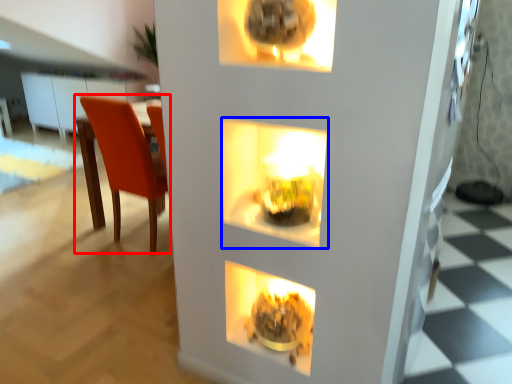
Question: Which object is closer to the camera taking this photo, chair (highlighted by a red box) or shelf (highlighted by a blue box)?

Choices:
 (A) chair
 (B) shelf

Answer: (B)